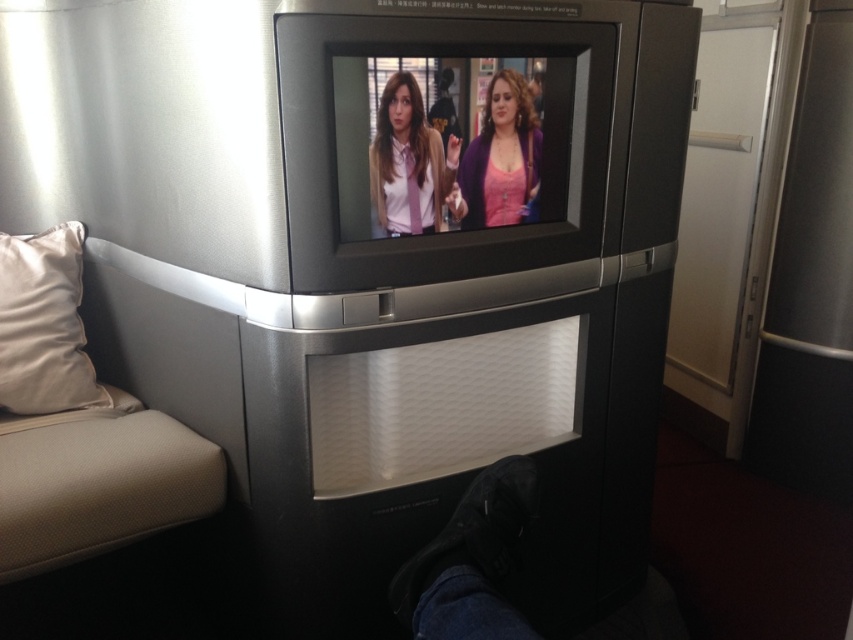
Describe the element at coordinates (410, 164) in the screenshot. The height and width of the screenshot is (640, 853). I see `matte pink tie at center` at that location.

Who is positioned more to the right, matte pink tie at center or pink matte sweater at center?

Positioned to the right is pink matte sweater at center.

Consider the image. Who is more forward, (426, 227) or (500, 84)?

Point (500, 84)

Find the location of a particular element. This screenshot has height=640, width=853. matte pink tie at center is located at coordinates (410, 164).

Is point (61, 339) behind point (519, 168)?

Yes.

Is beige velvet pillow at left shorter than pink matte sweater at center?

Incorrect, beige velvet pillow at left's height does not fall short of pink matte sweater at center's.

Is point (57, 408) less distant than point (461, 184)?

No, (57, 408) is behind (461, 184).

Locate an element on the screen. This screenshot has width=853, height=640. beige velvet pillow at left is located at coordinates (44, 324).

Who is higher up, beige velvet pillow at left or matte pink tie at center?

Positioned higher is matte pink tie at center.

Which is behind, point (70, 317) or point (380, 227)?

The point (70, 317) is behind.

Find the location of a particular element. beige velvet pillow at left is located at coordinates (44, 324).